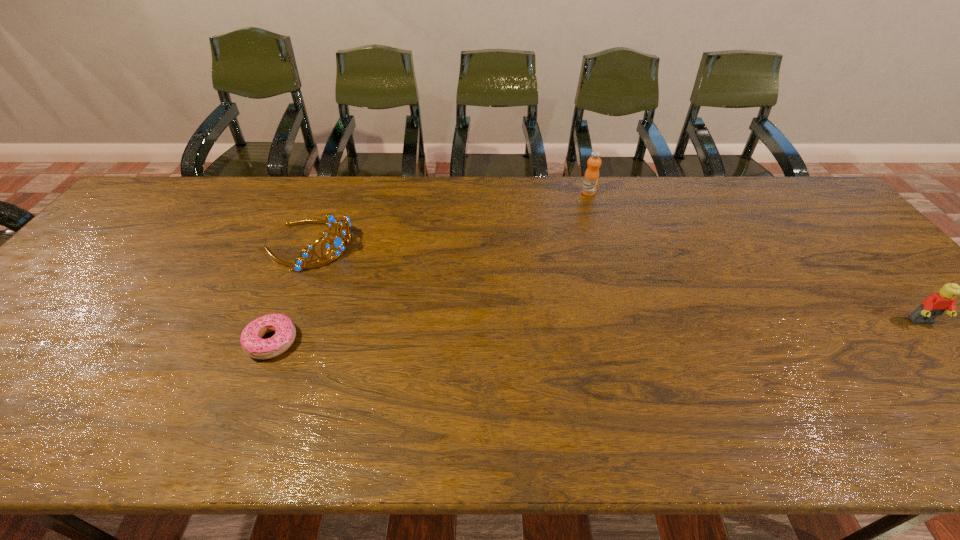
This screenshot has width=960, height=540. In order to click on vacant space at the far left corner of the desktop in this screenshot , I will do `click(180, 195)`.

At what (x,y) coordinates should I click in order to perform the action: click on free spot at the near left corner of the desktop. Please return your answer as a coordinate pair (x, y). The image size is (960, 540). Looking at the image, I should click on (18, 384).

Locate an element on the screen. Image resolution: width=960 pixels, height=540 pixels. vacant point located between the tiara and the third object from left to right is located at coordinates (448, 220).

At what (x,y) coordinates should I click in order to perform the action: click on free spot between the farthest object and the Lego. Please return your answer as a coordinate pair (x, y). This screenshot has height=540, width=960. Looking at the image, I should click on pyautogui.click(x=755, y=257).

Find the location of `blank region between the second shortest object and the shortest object`. blank region between the second shortest object and the shortest object is located at coordinates 597,332.

Locate an element on the screen. This screenshot has height=540, width=960. empty space between the rightmost object and the third object from left to right is located at coordinates tap(755, 257).

The height and width of the screenshot is (540, 960). I want to click on vacant point located between the rightmost object and the shortest object, so click(597, 332).

This screenshot has height=540, width=960. Find the location of `unoccupied position between the farthest object and the second farthest object`. unoccupied position between the farthest object and the second farthest object is located at coordinates (448, 220).

Where is `free point between the tiara and the doughnut`? free point between the tiara and the doughnut is located at coordinates (290, 294).

At what (x,y) coordinates should I click in order to perform the action: click on vacant area between the second farthest object and the shortest object. Please return your answer as a coordinate pair (x, y). The image size is (960, 540). Looking at the image, I should click on (290, 294).